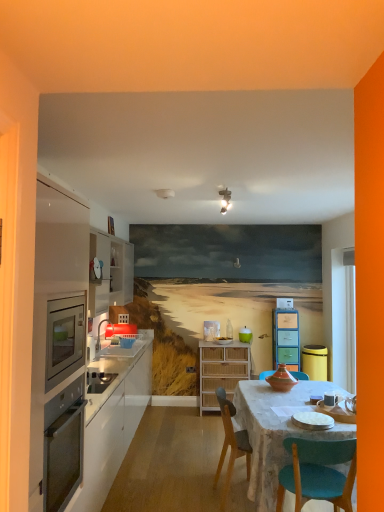
Question: From a real-world perspective, is bamboo cabinet at center, acting as the 2th cabinetry starting from the right, over marble table at center?

Choices:
 (A) yes
 (B) no

Answer: (A)

Question: Can you confirm if bamboo cabinet at center, marked as the 3th cabinetry in a front-to-back arrangement, is thinner than marble table at center?

Choices:
 (A) yes
 (B) no

Answer: (A)

Question: Can you confirm if bamboo cabinet at center, acting as the second cabinetry starting from the back, is wider than marble table at center?

Choices:
 (A) no
 (B) yes

Answer: (A)

Question: Considering the relative sizes of bamboo cabinet at center, positioned as the 3th cabinetry in left-to-right order, and marble table at center in the image provided, is bamboo cabinet at center, positioned as the 3th cabinetry in left-to-right order, taller than marble table at center?

Choices:
 (A) no
 (B) yes

Answer: (B)

Question: Is bamboo cabinet at center, acting as the second cabinetry starting from the back, surrounding marble table at center?

Choices:
 (A) yes
 (B) no

Answer: (B)

Question: From a real-world perspective, is bamboo cabinet at center, marked as the 3th cabinetry in a front-to-back arrangement, beneath marble table at center?

Choices:
 (A) no
 (B) yes

Answer: (A)

Question: Is white ceramic plate at center facing towards matte white sink at left?

Choices:
 (A) yes
 (B) no

Answer: (B)

Question: Considering the relative positions of white ceramic plate at center and matte white sink at left in the image provided, is white ceramic plate at center in front of matte white sink at left?

Choices:
 (A) no
 (B) yes

Answer: (B)

Question: Does white ceramic plate at center have a lesser width compared to matte white sink at left?

Choices:
 (A) no
 (B) yes

Answer: (B)

Question: Considering the relative sizes of white ceramic plate at center and matte white sink at left in the image provided, is white ceramic plate at center wider than matte white sink at left?

Choices:
 (A) no
 (B) yes

Answer: (A)

Question: Considering the relative sizes of white ceramic plate at center and matte white sink at left in the image provided, is white ceramic plate at center taller than matte white sink at left?

Choices:
 (A) no
 (B) yes

Answer: (A)

Question: Is white ceramic plate at center bigger than matte white sink at left?

Choices:
 (A) yes
 (B) no

Answer: (B)

Question: Considering the relative positions of wooden chair at center and matte white sink at left in the image provided, is wooden chair at center to the right of matte white sink at left from the viewer's perspective?

Choices:
 (A) yes
 (B) no

Answer: (A)